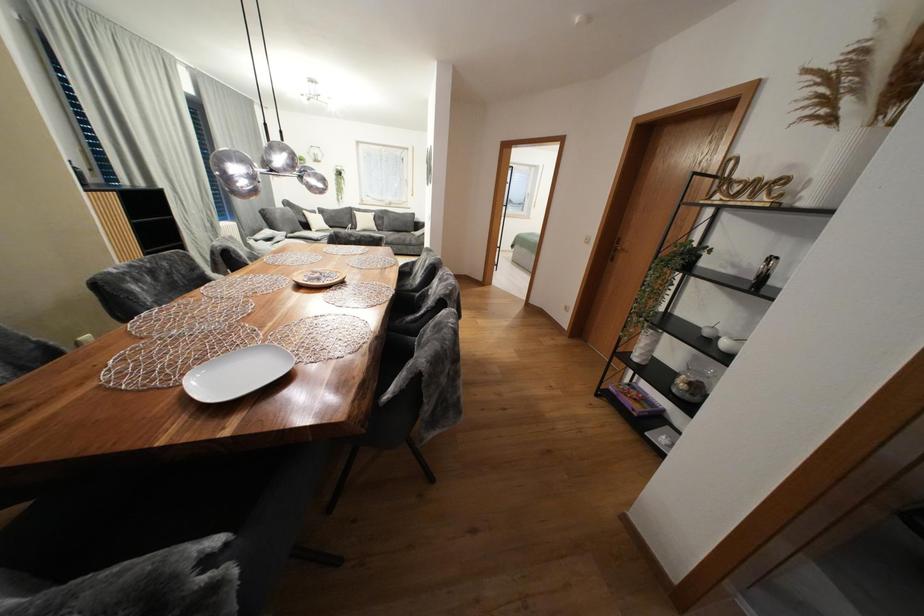
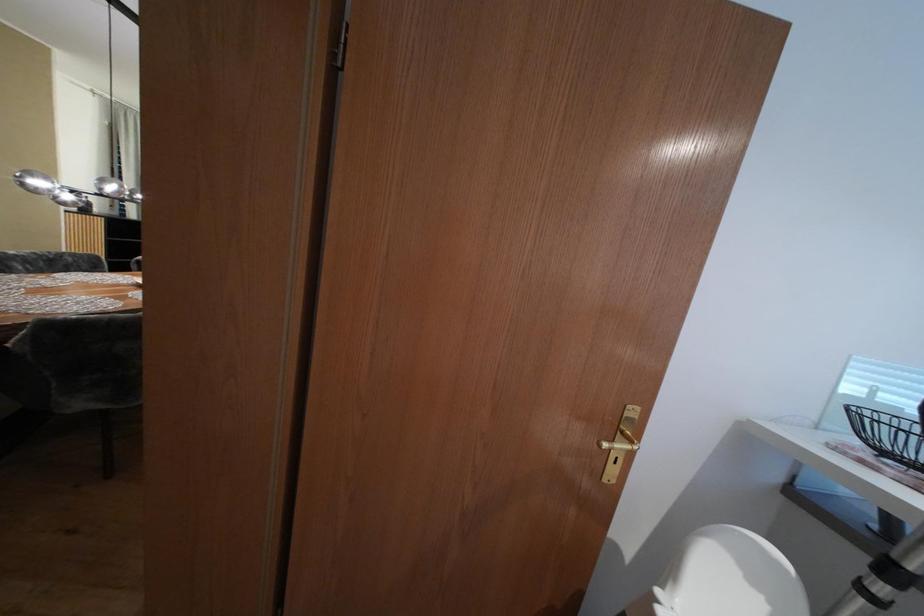
Question: Which direction would the cameraman need to move to produce the second image? Reply with the corresponding letter.

Choices:
 (A) Left
 (B) Right
 (C) Forward
 (D) Backward

Answer: (B)